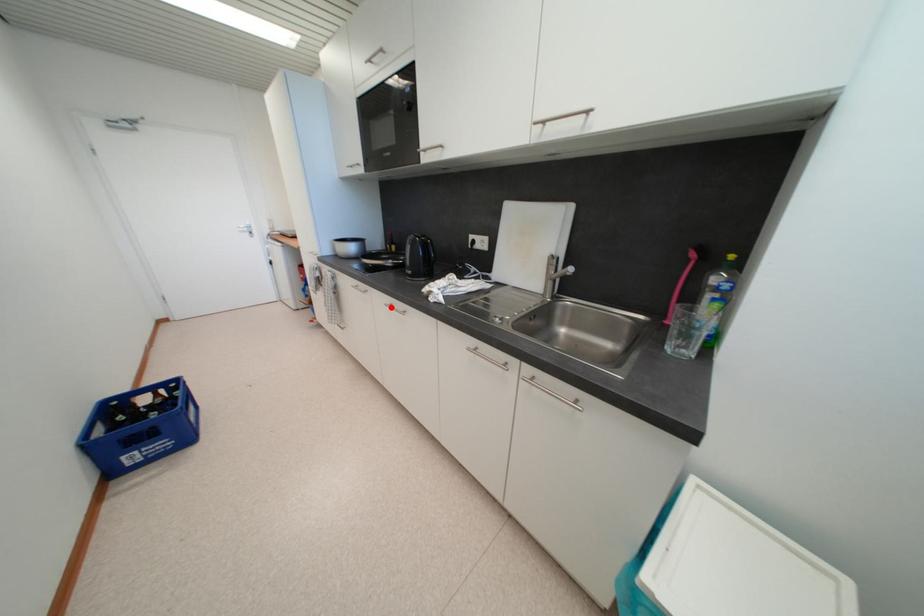
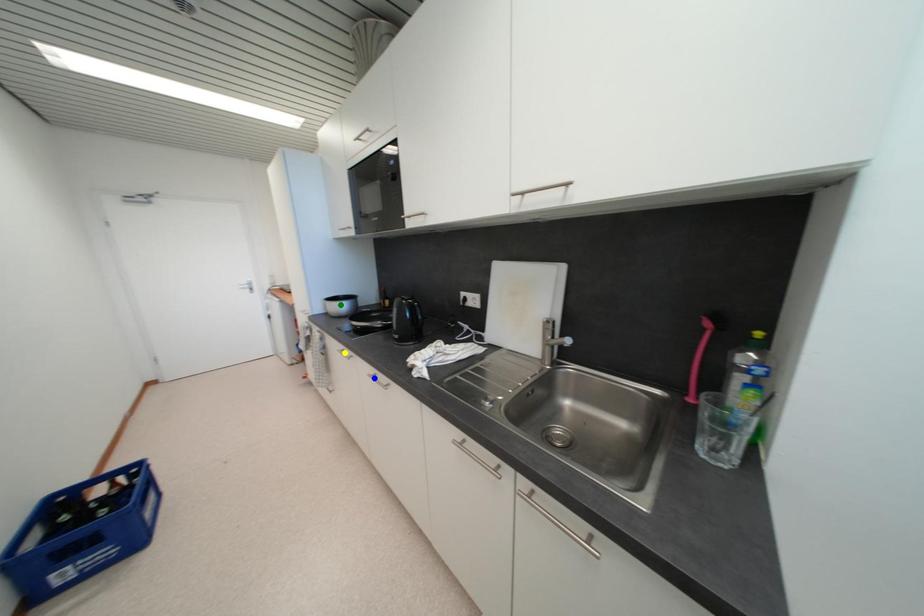
Question: I am providing you with two images of the same scene from different viewpoints. A red point is marked on the first image. You are given multiple points on the second image. Which point in image 2 represents the same 3d spot as the red point in image 1?

Choices:
 (A) green point
 (B) yellow point
 (C) blue point

Answer: (C)